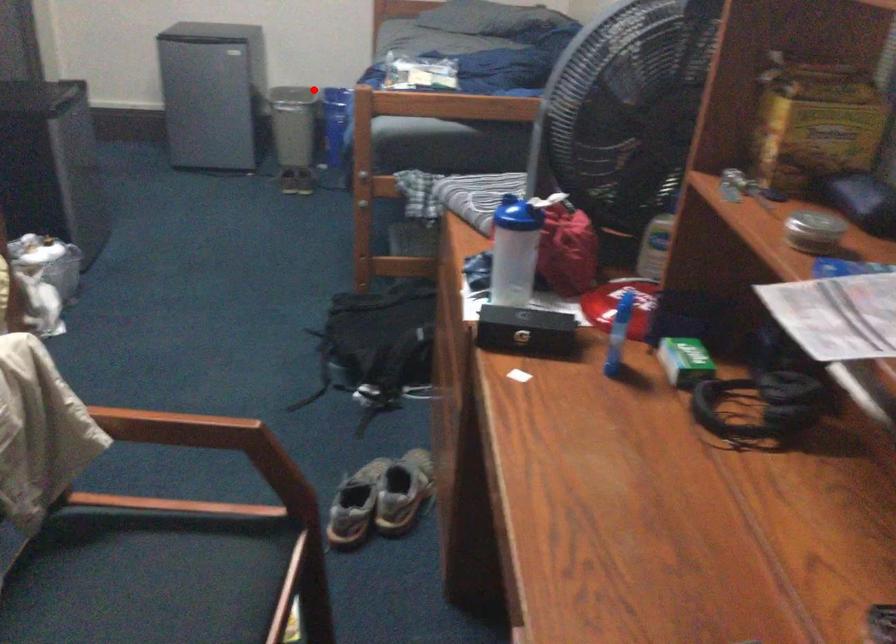
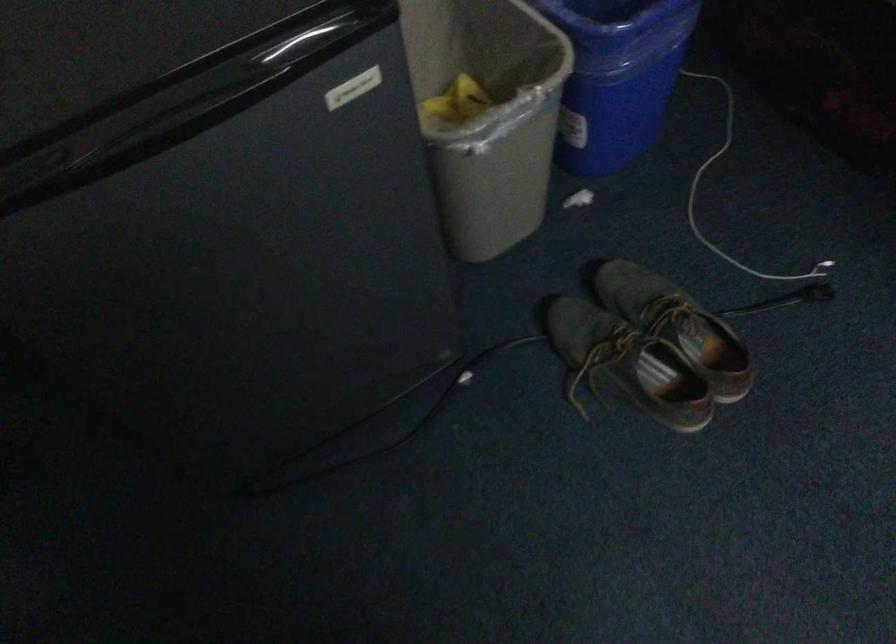
Locate, in the second image, the point that corresponds to the highlighted location in the first image.

(616, 76)